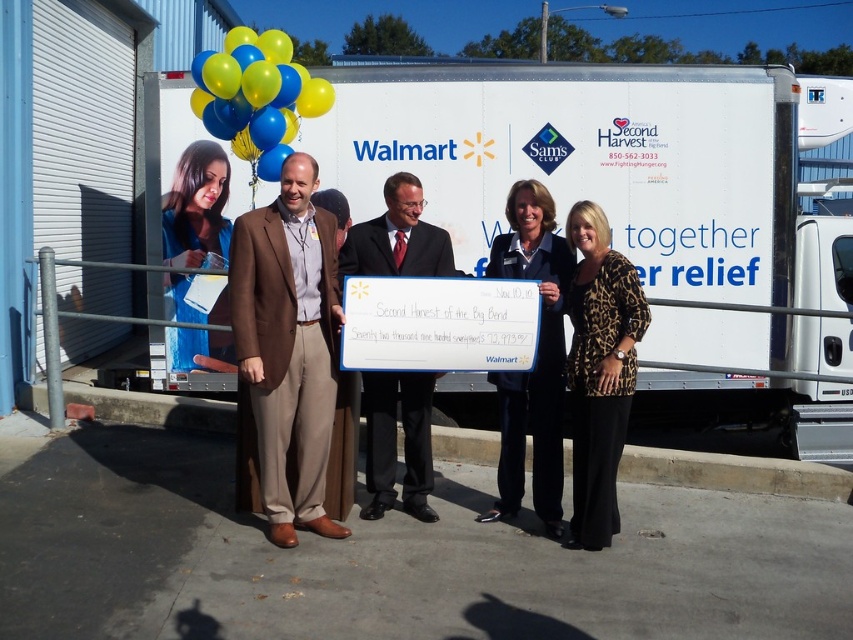
You are organizing an event and need to place a 1.2 meter wide banner between the brown suit at center and the blue glossy balloons at upper left. Can the space accommodate the banner?

The brown suit at center has a lesser width compared to blue glossy balloons at upper left, but the exact dimensions of the space between them are not provided. Without knowing the distance between the two objects, it is impossible to determine if the banner will fit.

What object is located at the coordinates point (535,360) in the image?

The point (535,360) is on the dark blue suit at center.

You are attending a charity event and see the dark blue suit at center and the blue fabric at upper left. Which object is closer to the ground?

The dark blue suit at center is positioned under blue fabric at upper left, so the dark blue suit at center is closer to the ground.